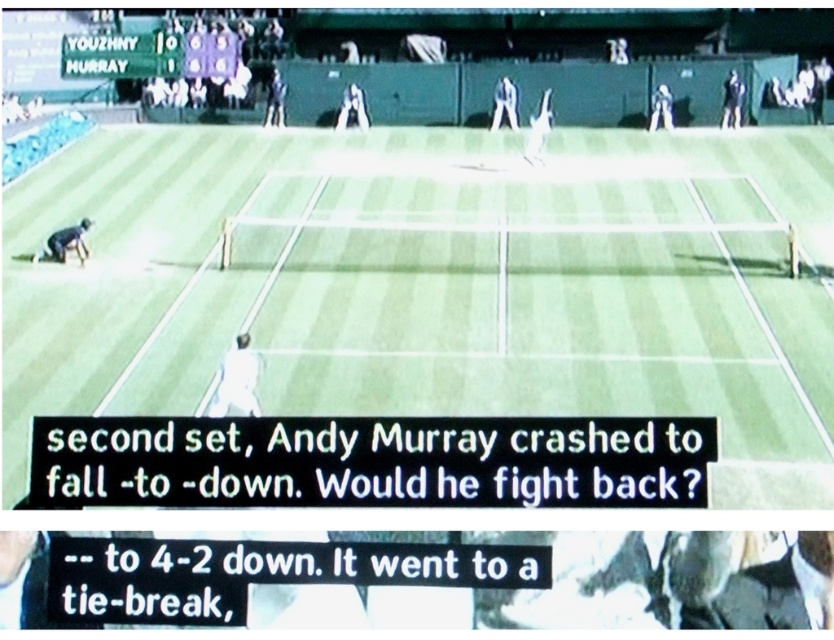
You are a sports analyst watching the tennis match on TV. You notice the white fabric tennis player at center and the black fabric person at upper right. Which player is positioned closer to the left side of the screen?

The white fabric tennis player at center is positioned to the left of the black fabric person at upper right, so the white fabric tennis player at center is closer to the left side of the screen.

You are a sports analyst watching the tennis match on TV. You notice two players at upper center of the screen. Which player is nearer to you, the white fabric tennis player at upper center or the dark blue jersey at upper center?

The white fabric tennis player at upper center is closer to the viewer than the dark blue jersey at upper center.

You are a sports analyst watching a tennis match on TV. You need to determine the position of the white fabric tennis player at upper center. What are the coordinates of this player?

The coordinates of the white fabric tennis player at upper center are at point [505,104].